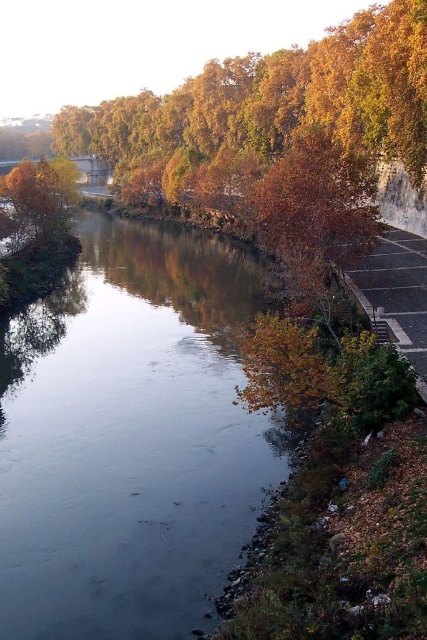
Does dark reflective water at center have a lesser height compared to golden textured tree at lower left?

Yes, dark reflective water at center is shorter than golden textured tree at lower left.

What do you see at coordinates (129, 438) in the screenshot? This screenshot has height=640, width=427. I see `dark reflective water at center` at bounding box center [129, 438].

Describe the element at coordinates (129, 438) in the screenshot. The image size is (427, 640). I see `dark reflective water at center` at that location.

The width and height of the screenshot is (427, 640). In order to click on dark reflective water at center in this screenshot , I will do `click(129, 438)`.